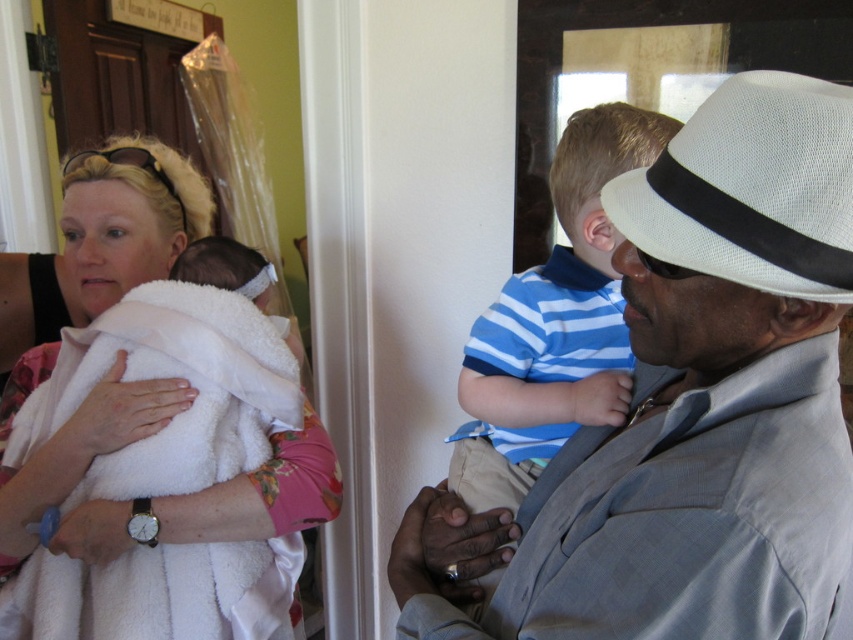
Question: Does light gray checkered suit at center come behind white fluffy towel at left?

Choices:
 (A) yes
 (B) no

Answer: (B)

Question: Does light gray checkered suit at center have a smaller size compared to white fluffy towel at left?

Choices:
 (A) no
 (B) yes

Answer: (B)

Question: Which object is positioned closest to the white fluffy towel at left?

Choices:
 (A) white fabric hat at right
 (B) light gray checkered suit at center

Answer: (B)

Question: Observing the image, what is the correct spatial positioning of white fluffy towel at left in reference to white fabric hat at right?

Choices:
 (A) below
 (B) above

Answer: (A)

Question: Which point appears closest to the camera in this image?

Choices:
 (A) (428, 490)
 (B) (828, 124)
 (C) (33, 355)

Answer: (B)

Question: Which object is farther from the camera taking this photo?

Choices:
 (A) light gray checkered suit at center
 (B) white fluffy towel at left
 (C) white fabric hat at right

Answer: (B)